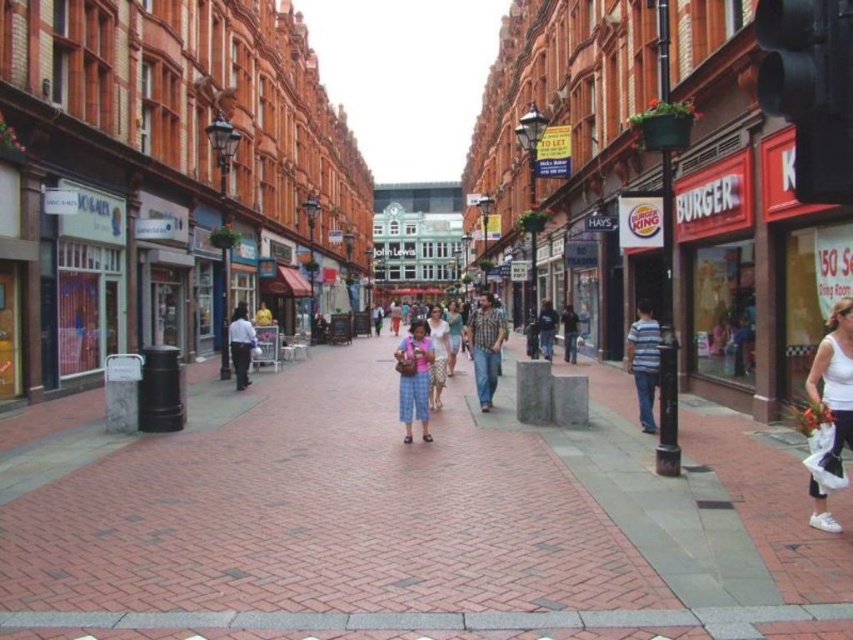
You are a delivery robot with a 1.2 meter width. You are positioned at the striped cotton shirt at right and need to reach the light blue jeans at center. Is there enough space for you to navigate the path between them?

The distance between the striped cotton shirt at right and light blue jeans at center is 13.65 meters. Since the robot is 1.2 meters wide, the path is wide enough for the robot to navigate between them.

You are a delivery person standing at the entrance of HAY S and need to place a package on the light blue jeans at center. Can you reach it without moving from your current position?

The light blue jeans at center is 78.55 feet away from you, so you cannot reach it without moving from your current position at the entrance of HAY S.